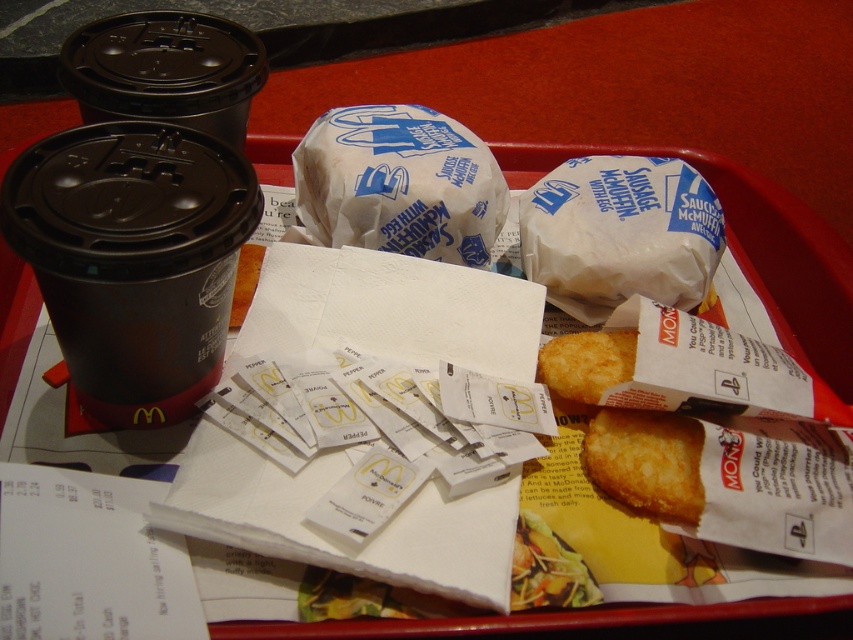
Does yellow paper packet at center appear over golden crispy nugget at center?

Actually, yellow paper packet at center is below golden crispy nugget at center.

Is yellow paper packet at center thinner than golden crispy nugget at center?

Indeed, yellow paper packet at center has a lesser width compared to golden crispy nugget at center.

Is point (589, 589) behind point (595, 385)?

No, (589, 589) is closer to viewer.

Identify the location of yellow paper packet at center. (547, 568).

Which is more to the left, white paper wrapped sausage muffin at center or yellow paper packet at center?

yellow paper packet at center

Is point (676, 164) farther from viewer compared to point (523, 570)?

Yes, point (676, 164) is farther from viewer.

At what (x,y) coordinates should I click in order to perform the action: click on white paper wrapped sausage muffin at center. Please return your answer as a coordinate pair (x, y). This screenshot has height=640, width=853. Looking at the image, I should click on tap(619, 234).

The height and width of the screenshot is (640, 853). Find the location of `white paper wrapped sausage muffin at center`. white paper wrapped sausage muffin at center is located at coordinates (619, 234).

Which is in front, point (166, 381) or point (596, 397)?

Positioned in front is point (166, 381).

Identify the location of black paper cup at left. (132, 259).